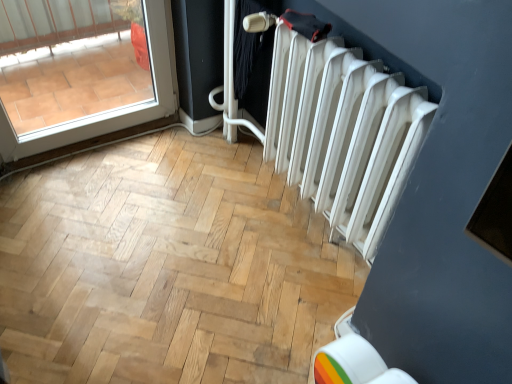
Where is `free space in front of white matte radiator at right`? Image resolution: width=512 pixels, height=384 pixels. free space in front of white matte radiator at right is located at coordinates (295, 308).